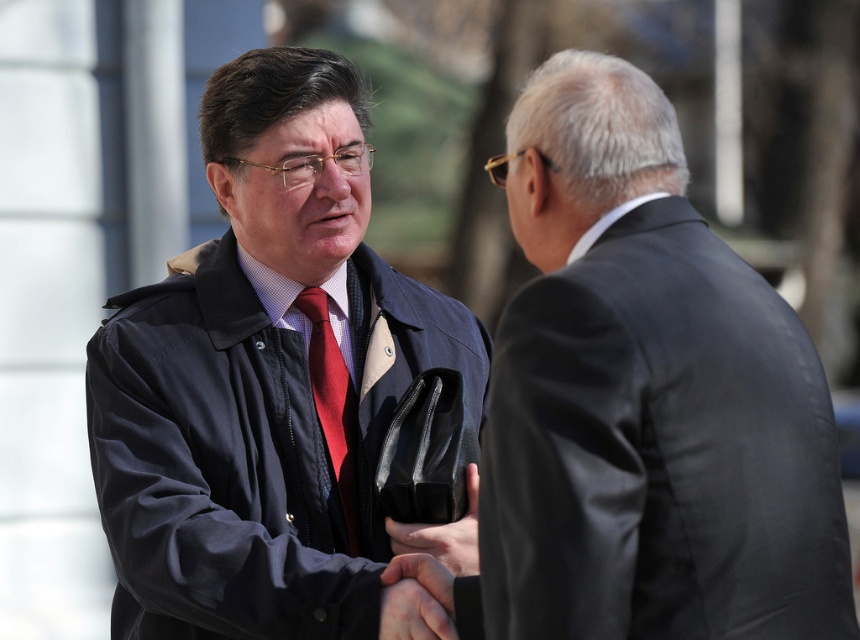
Question: Among these points, which one is farthest from the camera?

Choices:
 (A) (360, 609)
 (B) (459, 541)

Answer: (B)

Question: Does black satin suit at right appear on the right side of matte black jacket at center?

Choices:
 (A) yes
 (B) no

Answer: (A)

Question: Can you confirm if matte black jacket at center is bigger than matte red tie at center?

Choices:
 (A) no
 (B) yes

Answer: (B)

Question: Which point appears closest to the camera in this image?

Choices:
 (A) (409, 548)
 (B) (654, 488)
 (C) (392, 316)
 (D) (336, 394)

Answer: (B)

Question: Which of the following is the closest to the observer?

Choices:
 (A) (396, 547)
 (B) (349, 592)
 (C) (354, 477)
 (D) (630, 525)

Answer: (D)

Question: Is matte black jacket at center thinner than black leather handbag at center?

Choices:
 (A) yes
 (B) no

Answer: (B)